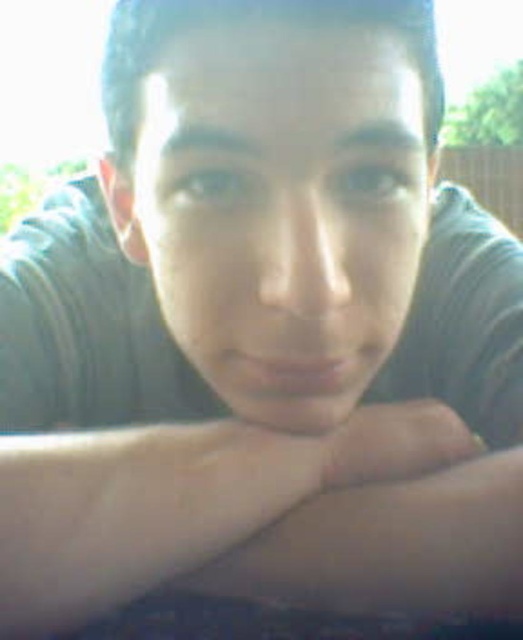
Question: Is skinny white arm at center to the left of smooth skin at center from the viewer's perspective?

Choices:
 (A) yes
 (B) no

Answer: (A)

Question: Among these points, which one is nearest to the camera?

Choices:
 (A) (312, 392)
 (B) (346, 486)

Answer: (A)

Question: Does skinny white arm at center appear over smooth skin at center?

Choices:
 (A) yes
 (B) no

Answer: (B)

Question: Which point is farther to the camera?

Choices:
 (A) (48, 628)
 (B) (221, 360)

Answer: (B)

Question: Does skinny white arm at center have a larger size compared to smooth skin at center?

Choices:
 (A) yes
 (B) no

Answer: (A)